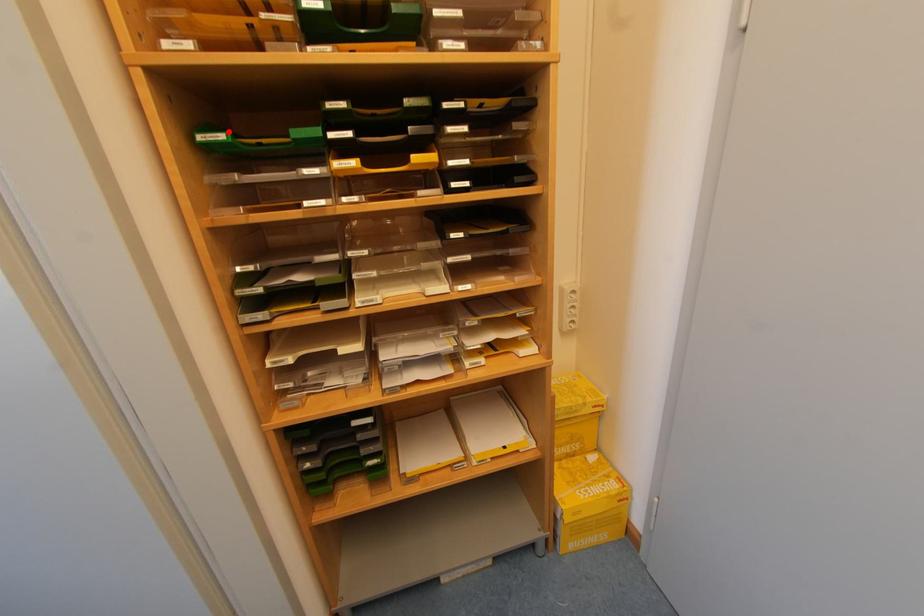
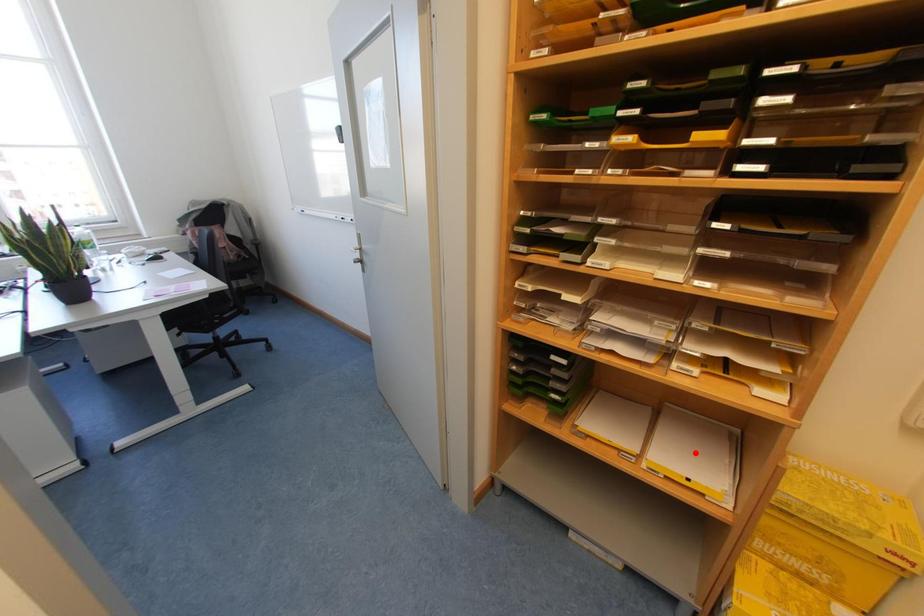
I am providing you with two images of the same scene from different viewpoints. A red point is marked on the first image and another point is marked on the second image. Do the highlighted points in image1 and image2 indicate the same real-world spot?

No